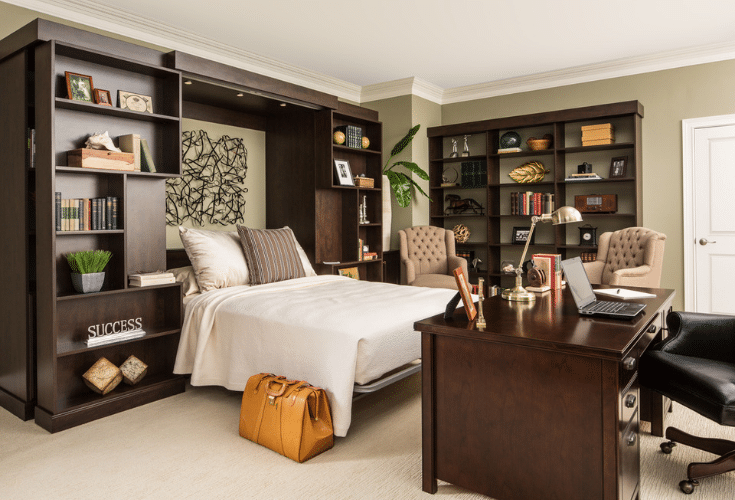
Find the location of a particular element. This screenshot has height=500, width=735. dark brown shelves is located at coordinates (487, 213), (562, 196).